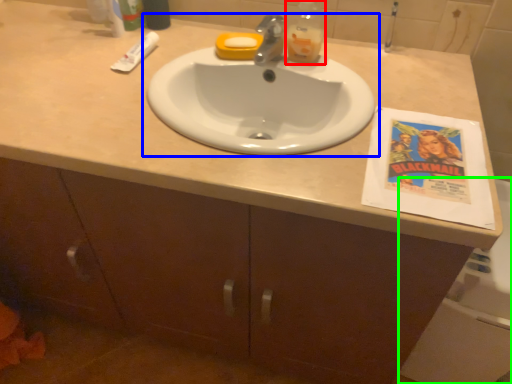
Question: Estimate the real-world distances between objects in this image. Which object is closer to bottle (highlighted by a red box), sink (highlighted by a blue box) or bath (highlighted by a green box)?

Choices:
 (A) sink
 (B) bath

Answer: (A)